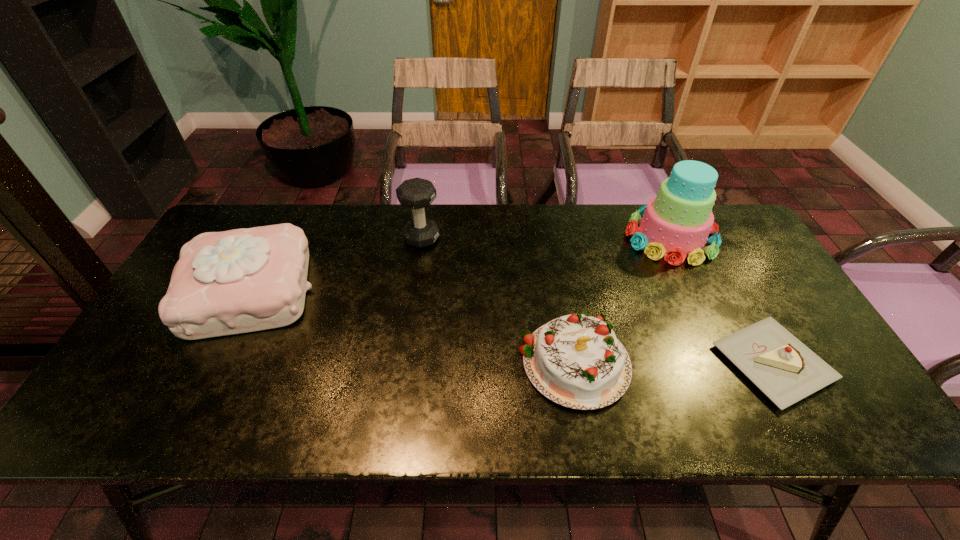
Locate an element on the screen. object that is the nearest to the shortest cake is located at coordinates (676, 223).

Identify the location of the third closest object relative to the third object from right to left. (417, 193).

Point out which cake is positioned as the third nearest to the leftmost object. Please provide its 2D coordinates. Your answer should be formatted as a tuple, i.e. [(x, y)], where the tuple contains the x and y coordinates of a point satisfying the conditions above.

[(781, 366)]

Where is `cake that can be found as the third closest to the leftmost cake`? cake that can be found as the third closest to the leftmost cake is located at coordinates (781, 366).

Where is `free space that satisfies the following two spatial constraints: 1. on the back side of the tallest object; 2. on the right side of the third object from right to left`? free space that satisfies the following two spatial constraints: 1. on the back side of the tallest object; 2. on the right side of the third object from right to left is located at coordinates (552, 237).

This screenshot has width=960, height=540. What are the coordinates of `vacant space that satisfies the following two spatial constraints: 1. on the back side of the leftmost object; 2. on the right side of the tallest object` in the screenshot? It's located at (276, 237).

Identify the location of free spot that satisfies the following two spatial constraints: 1. on the back side of the tallest cake; 2. on the left side of the fourth shortest object. (421, 237).

At what (x,y) coordinates should I click in order to perform the action: click on blank area in the image that satisfies the following two spatial constraints: 1. on the front side of the third object from left to right; 2. on the left side of the fourth shortest object. Please return your answer as a coordinate pair (x, y). The height and width of the screenshot is (540, 960). Looking at the image, I should click on (404, 361).

Image resolution: width=960 pixels, height=540 pixels. Identify the location of vacant space that satisfies the following two spatial constraints: 1. on the back side of the leftmost cake; 2. on the right side of the tallest cake. (276, 237).